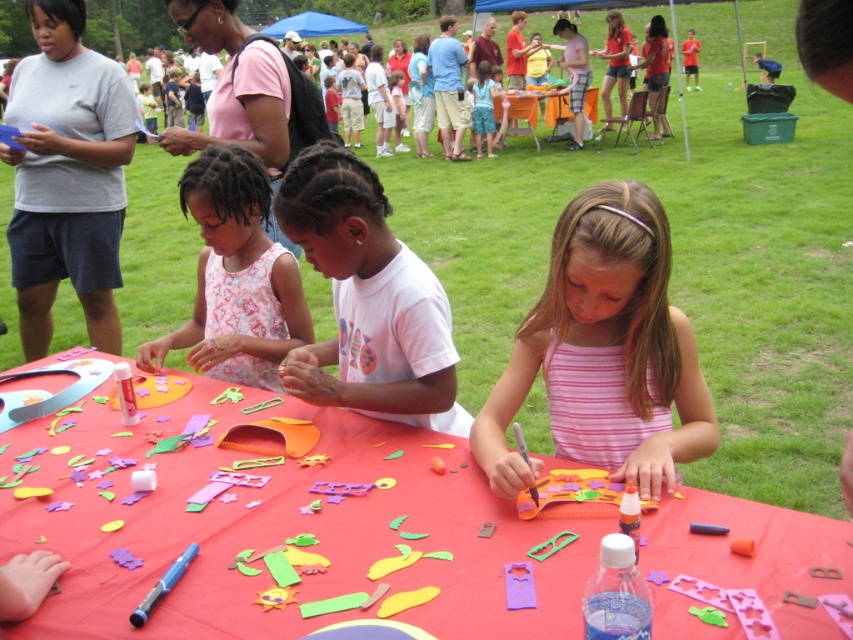
Is pink striped tank top at center smaller than floral fabric dress at center?

Indeed, pink striped tank top at center has a smaller size compared to floral fabric dress at center.

Who is taller, pink striped tank top at center or floral fabric dress at center?

Standing taller between the two is floral fabric dress at center.

Which is behind, point (575, 449) or point (260, 330)?

Positioned behind is point (260, 330).

Where is `pink striped tank top at center`? The height and width of the screenshot is (640, 853). pink striped tank top at center is located at coordinates (604, 352).

How far apart are white cotton shirt at center and floral fabric dress at center?

white cotton shirt at center is 17.41 inches away from floral fabric dress at center.

Is white cotton shirt at center bigger than floral fabric dress at center?

No, white cotton shirt at center is not bigger than floral fabric dress at center.

Does point (308, 200) come in front of point (241, 346)?

Yes, it is.

Locate an element on the screen. The image size is (853, 640). white cotton shirt at center is located at coordinates (367, 300).

Is red felt table at center to the left of white cotton shirt at center from the viewer's perspective?

Indeed, red felt table at center is positioned on the left side of white cotton shirt at center.

Is point (845, 564) closer to viewer compared to point (393, 282)?

Yes.

At what (x,y) coordinates should I click in order to perform the action: click on red felt table at center. Please return your answer as a coordinate pair (x, y). Looking at the image, I should click on (285, 531).